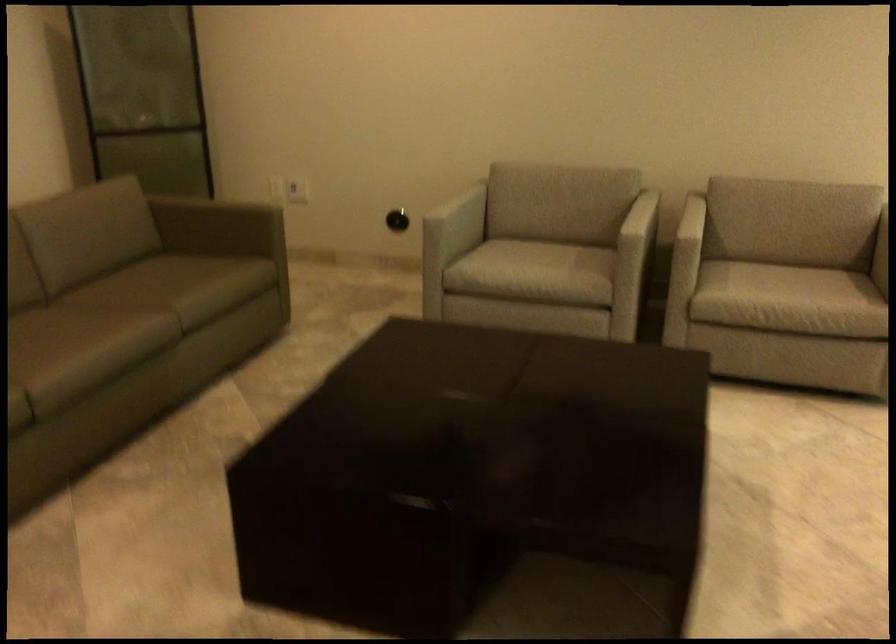
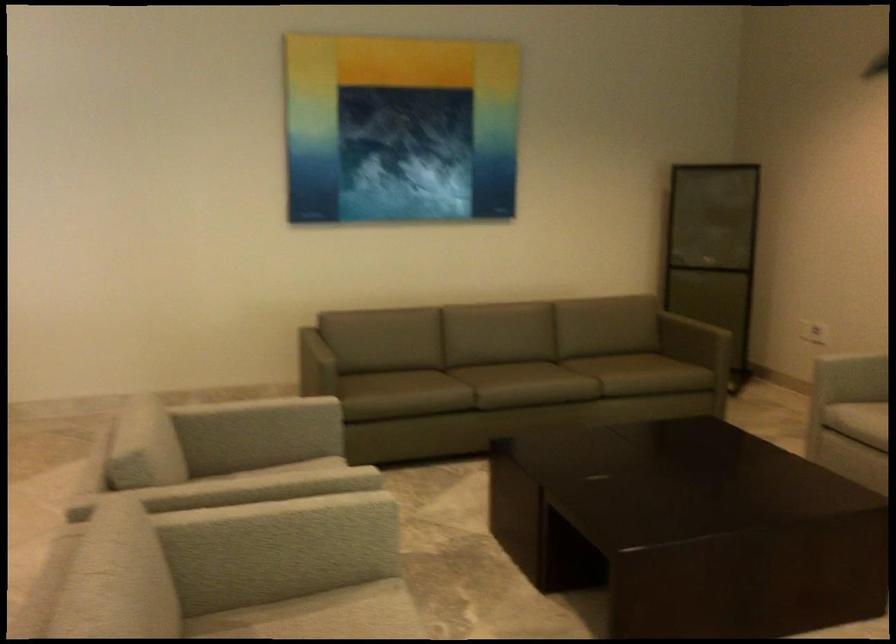
In the second image, find the point that corresponds to point 116,348 in the first image.

(524, 384)